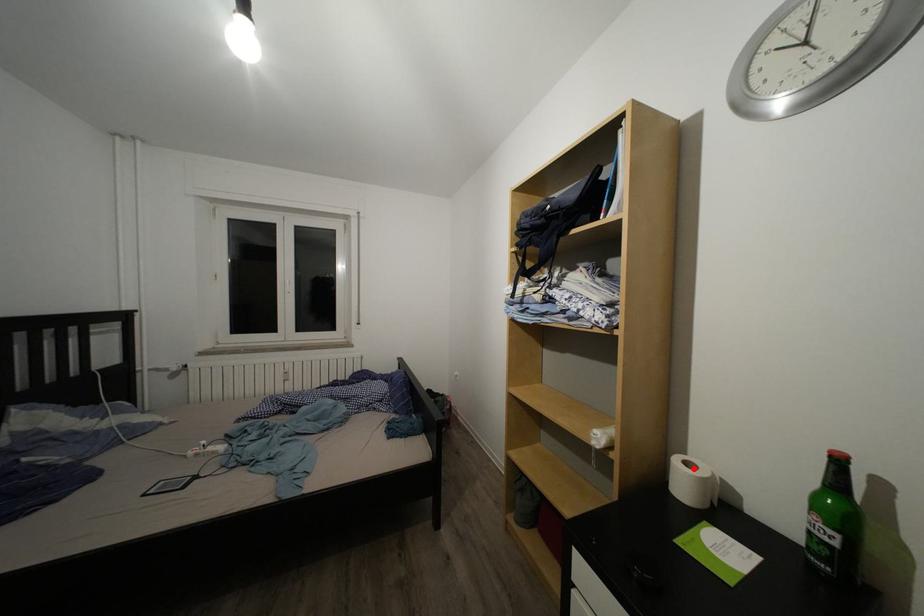
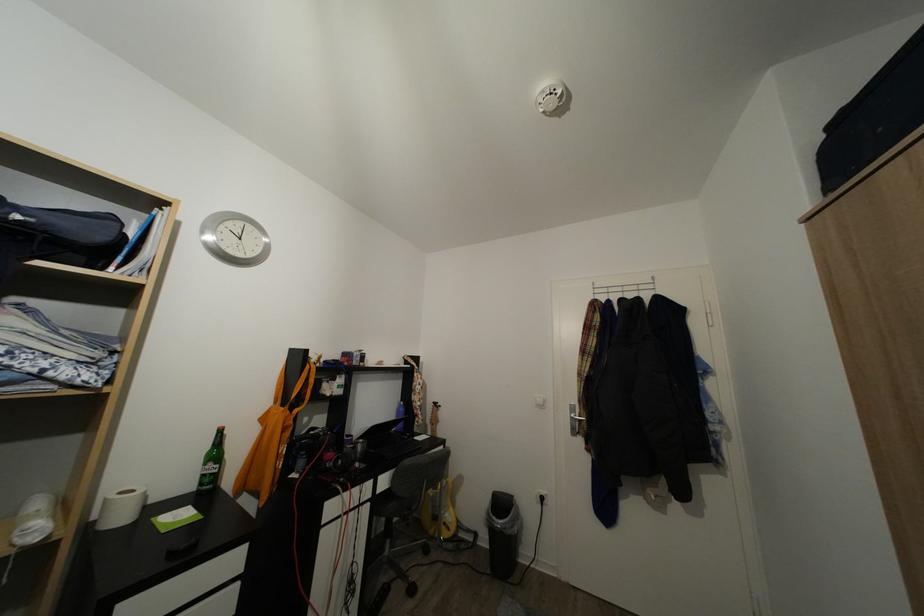
Find the pixel in the second image that matches the highlighted location in the first image.

(129, 500)